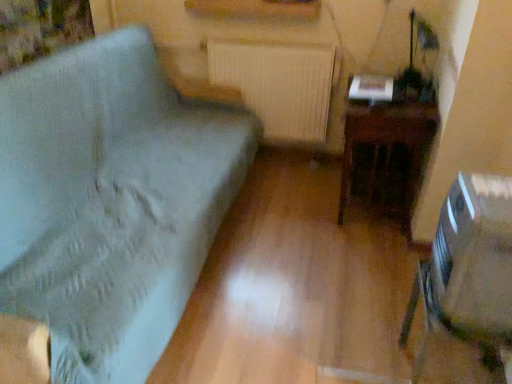
The height and width of the screenshot is (384, 512). Identify the location of unoccupied area in front of dark wood table at right. (360, 256).